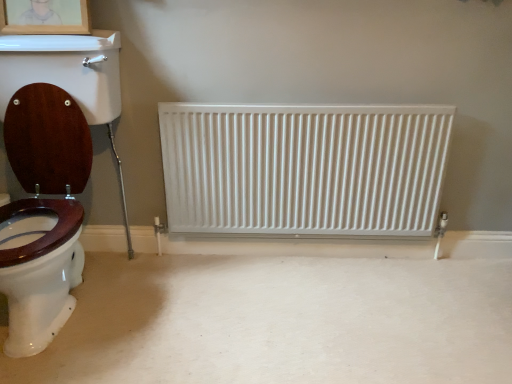
What do you see at coordinates (304, 168) in the screenshot?
I see `white matte radiator at center` at bounding box center [304, 168].

Locate an element on the screen. Image resolution: width=512 pixels, height=384 pixels. white matte radiator at center is located at coordinates (304, 168).

Measure the distance between white matte radiator at center and camera.

white matte radiator at center is 1.70 meters from camera.

The image size is (512, 384). I want to click on white matte radiator at center, so click(x=304, y=168).